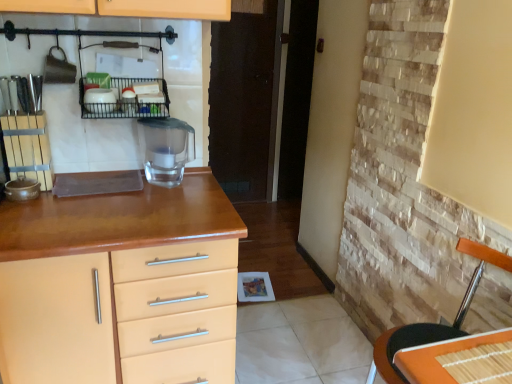
Question: Considering the relative sizes of orange bamboo placemat at lower right and matte wood chest of drawers at left in the image provided, is orange bamboo placemat at lower right shorter than matte wood chest of drawers at left?

Choices:
 (A) no
 (B) yes

Answer: (B)

Question: Is orange bamboo placemat at lower right further to camera compared to matte wood chest of drawers at left?

Choices:
 (A) yes
 (B) no

Answer: (B)

Question: Is orange bamboo placemat at lower right not near matte wood chest of drawers at left?

Choices:
 (A) no
 (B) yes

Answer: (A)

Question: Is orange bamboo placemat at lower right facing away from matte wood chest of drawers at left?

Choices:
 (A) no
 (B) yes

Answer: (A)

Question: Is orange bamboo placemat at lower right touching matte wood chest of drawers at left?

Choices:
 (A) yes
 (B) no

Answer: (B)

Question: Looking at the image, does black wire rack at upper center seem bigger or smaller compared to matte wood chest of drawers at left?

Choices:
 (A) big
 (B) small

Answer: (B)

Question: Considering the positions of point (166, 99) and point (196, 281), is point (166, 99) closer or farther from the camera than point (196, 281)?

Choices:
 (A) farther
 (B) closer

Answer: (A)

Question: Looking at their shapes, would you say black wire rack at upper center is wider or thinner than matte wood chest of drawers at left?

Choices:
 (A) wide
 (B) thin

Answer: (B)

Question: From the image's perspective, is black wire rack at upper center above or below matte wood chest of drawers at left?

Choices:
 (A) above
 (B) below

Answer: (A)

Question: Relative to transparent glass water filter at center, is orange bamboo placemat at lower right in front or behind?

Choices:
 (A) behind
 (B) front

Answer: (B)

Question: Does point (508, 339) appear closer or farther from the camera than point (175, 135)?

Choices:
 (A) closer
 (B) farther

Answer: (A)

Question: From a real-world perspective, is orange bamboo placemat at lower right positioned above or below transparent glass water filter at center?

Choices:
 (A) above
 (B) below

Answer: (B)

Question: From the image's perspective, relative to transparent glass water filter at center, is orange bamboo placemat at lower right above or below?

Choices:
 (A) below
 (B) above

Answer: (A)

Question: Considering the positions of point (485, 357) and point (470, 296), is point (485, 357) closer or farther from the camera than point (470, 296)?

Choices:
 (A) farther
 (B) closer

Answer: (B)

Question: Visually, is orange bamboo placemat at lower right positioned to the left or to the right of orange woven mat at right?

Choices:
 (A) left
 (B) right

Answer: (B)